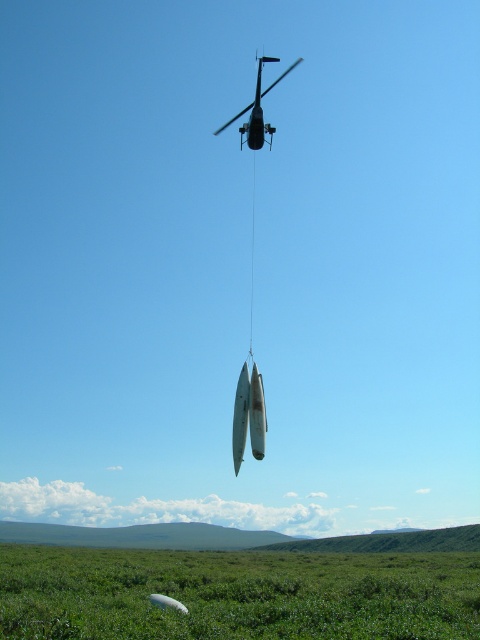
Question: Does green grassy field at lower center have a larger size compared to metallic silver helicopter at upper center?

Choices:
 (A) no
 (B) yes

Answer: (B)

Question: Considering the relative positions of green grassy field at lower center and metallic silver helicopter at upper center in the image provided, where is green grassy field at lower center located with respect to metallic silver helicopter at upper center?

Choices:
 (A) above
 (B) below

Answer: (B)

Question: Can you confirm if green grassy field at lower center is wider than metallic silver helicopter at upper center?

Choices:
 (A) yes
 (B) no

Answer: (A)

Question: Which of the following is the closest to the observer?

Choices:
 (A) green grassy field at lower center
 (B) metallic silver helicopter at upper center

Answer: (A)

Question: Which point is farther to the camera?

Choices:
 (A) metallic silver helicopter at upper center
 (B) green grassy field at lower center

Answer: (A)